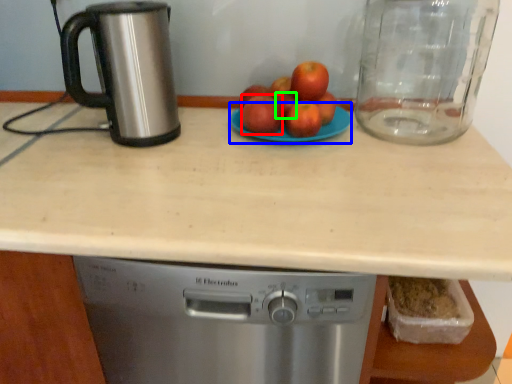
Question: Considering the real-world distances, which object is closest to apple (highlighted by a red box)? glass plate (highlighted by a blue box) or apple (highlighted by a green box).

Choices:
 (A) glass plate
 (B) apple

Answer: (B)